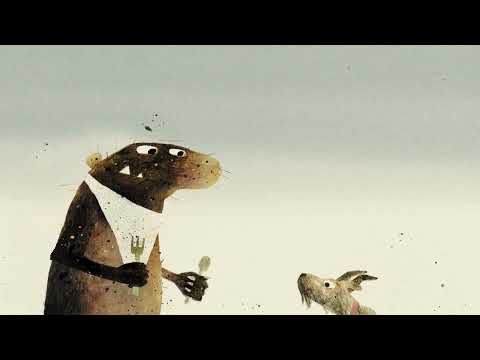
Find the location of a particular element. fork is located at coordinates (134, 253).